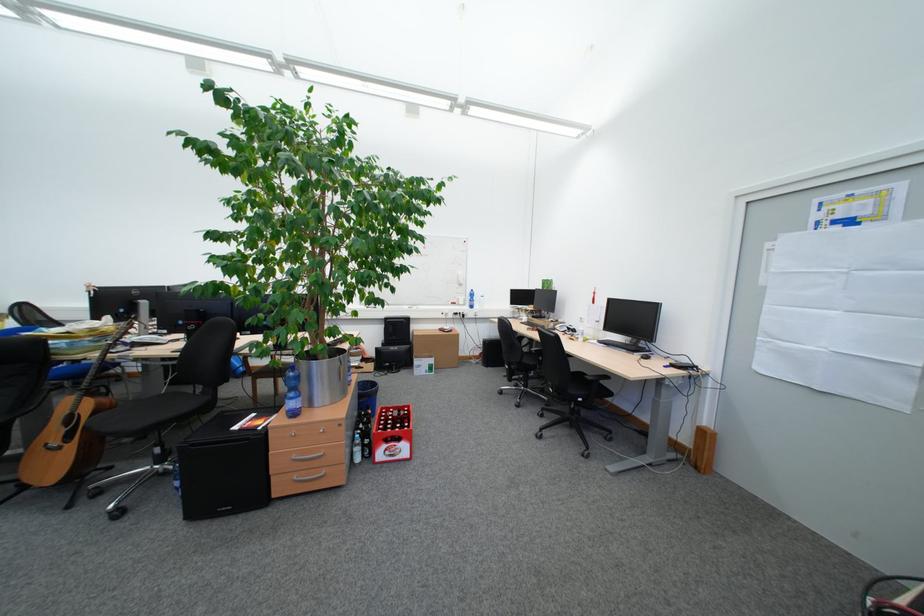
At what (x,y) coordinates should I click in order to perform the action: click on chair sitting surface. Please return your answer as a coordinate pair (x, y). This screenshot has height=616, width=924. Looking at the image, I should click on (141, 414).